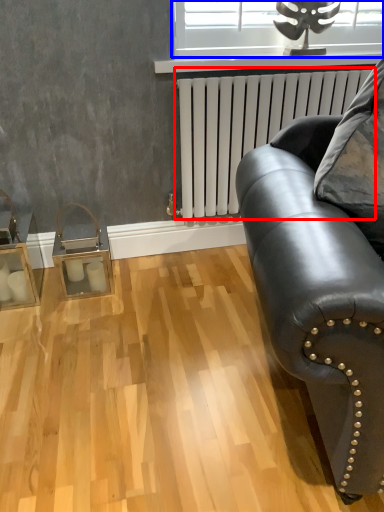
Question: Which object is closer to the camera taking this photo, radiator (highlighted by a red box) or window (highlighted by a blue box)?

Choices:
 (A) radiator
 (B) window

Answer: (A)